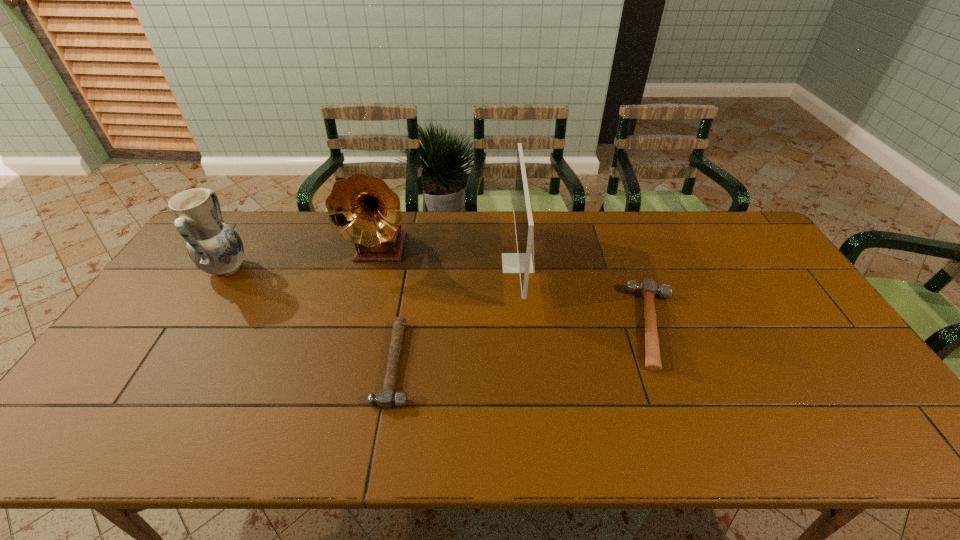
Locate an element on the screen. free spot at the near edge of the desktop is located at coordinates (785, 416).

In the image, there is a desktop. Identify the location of blank space at the left edge. This screenshot has width=960, height=540. (203, 280).

The height and width of the screenshot is (540, 960). What are the coordinates of `blank space at the right edge of the desktop` in the screenshot? It's located at 852,390.

In the image, there is a desktop. Where is `vacant space at the near left corner`? vacant space at the near left corner is located at coordinates (107, 418).

Image resolution: width=960 pixels, height=540 pixels. In order to click on vacant space at the far right corner of the desktop in this screenshot , I will do `click(702, 224)`.

Find the location of `free space between the monitor and the pottery`. free space between the monitor and the pottery is located at coordinates (372, 266).

I want to click on free spot between the right hammer and the phonograph_record, so click(518, 288).

I want to click on empty space between the left hammer and the phonograph_record, so click(388, 307).

Find the location of a particular element. The height and width of the screenshot is (540, 960). vacant space that is in between the left hammer and the pottery is located at coordinates (311, 316).

Where is `free space between the pottery and the phonograph_record`? free space between the pottery and the phonograph_record is located at coordinates (303, 260).